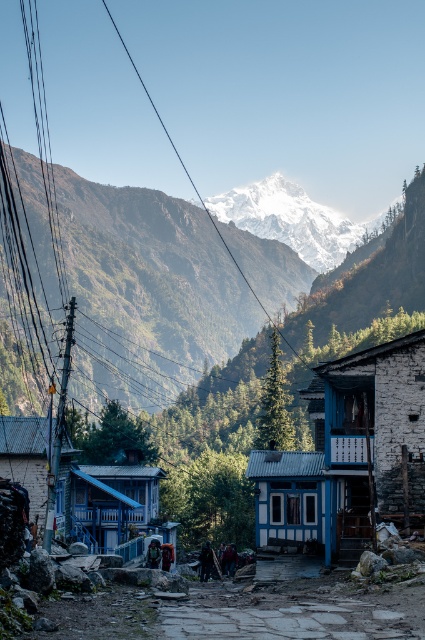
Can you confirm if white stone building at center is smaller than white snow-covered mountain at upper center?

Yes, white stone building at center is smaller than white snow-covered mountain at upper center.

Who is shorter, white stone building at center or white snow-covered mountain at upper center?

With less height is white stone building at center.

Describe the element at coordinates (374, 436) in the screenshot. The width and height of the screenshot is (425, 640). I see `white stone building at center` at that location.

Identify the location of white stone building at center. (374, 436).

Based on the photo, how far apart are white snow-covered mountain at upper center and white painted wood hut at lower left?

531.53 meters

Is point (379, 214) positioned after point (25, 456)?

That is True.

Which is in front, point (241, 212) or point (44, 449)?

Point (44, 449) is more forward.

Where is `white snow-covered mountain at upper center`? The width and height of the screenshot is (425, 640). white snow-covered mountain at upper center is located at coordinates (291, 220).

Is point (302, 509) more distant than point (31, 502)?

Yes, point (302, 509) is behind point (31, 502).

The height and width of the screenshot is (640, 425). What do you see at coordinates (288, 493) in the screenshot?
I see `blue corrugated metal hut at center` at bounding box center [288, 493].

Find the location of `blue corrugated metal hut at center`. blue corrugated metal hut at center is located at coordinates (288, 493).